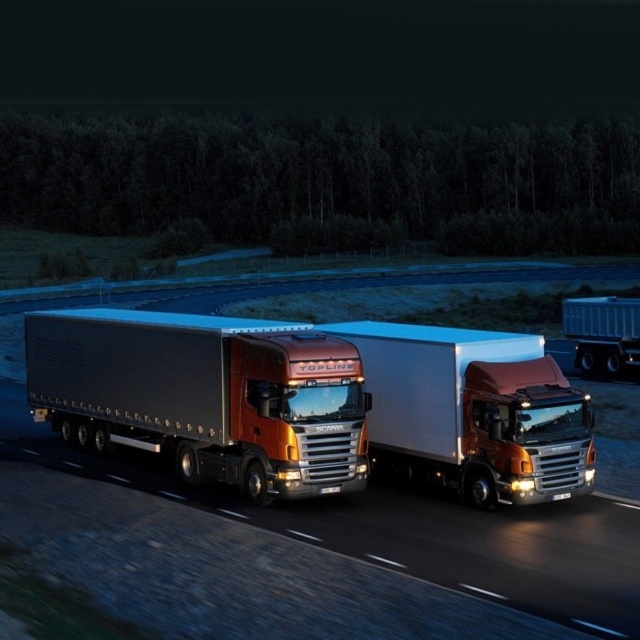
Question: Which point appears closest to the camera in this image?

Choices:
 (A) (600, 355)
 (B) (477, 413)

Answer: (B)

Question: Can you confirm if metallic silver trailer truck at center is positioned below metallic silver trailer at right?

Choices:
 (A) no
 (B) yes

Answer: (B)

Question: Among these objects, which one is farthest from the camera?

Choices:
 (A) metallic silver trailer at right
 (B) white glossy truck at center

Answer: (A)

Question: Can you confirm if metallic silver trailer truck at center is smaller than white glossy truck at center?

Choices:
 (A) yes
 (B) no

Answer: (B)

Question: Is the position of white glossy truck at center less distant than that of metallic silver trailer at right?

Choices:
 (A) no
 (B) yes

Answer: (B)

Question: Which of the following is the farthest from the observer?

Choices:
 (A) metallic silver trailer truck at center
 (B) metallic silver trailer at right
 (C) white glossy truck at center

Answer: (B)